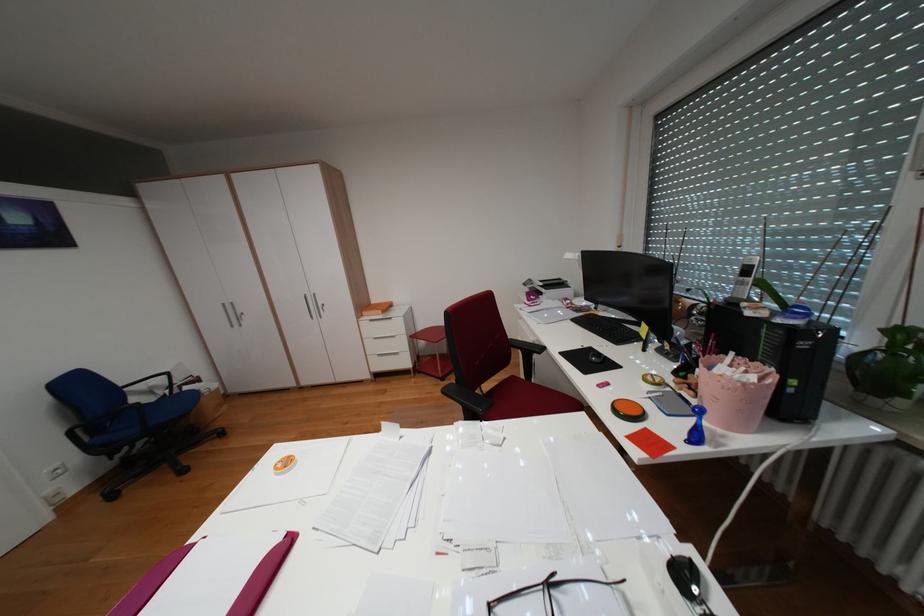
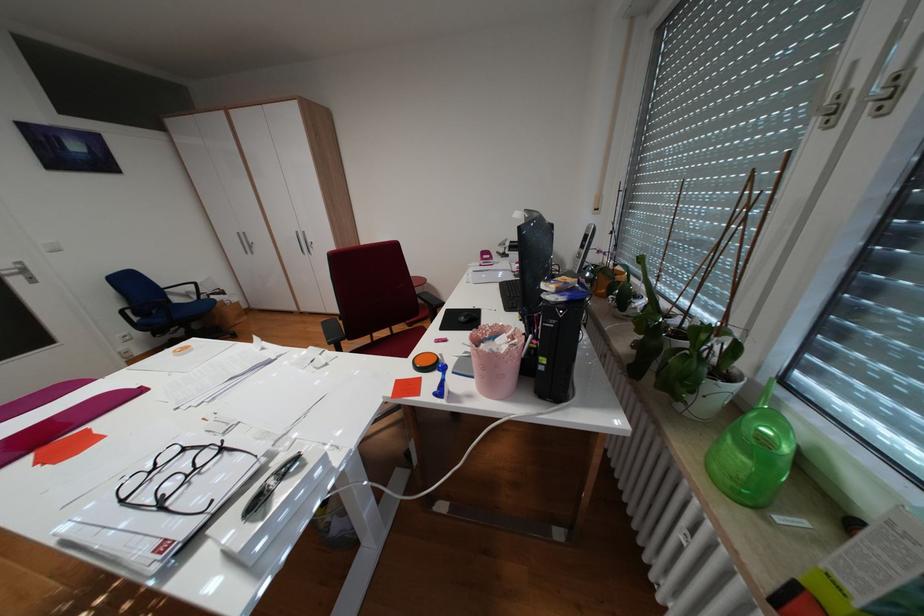
Locate, in the second image, the point that corresponds to (764,377) in the first image.

(517, 347)